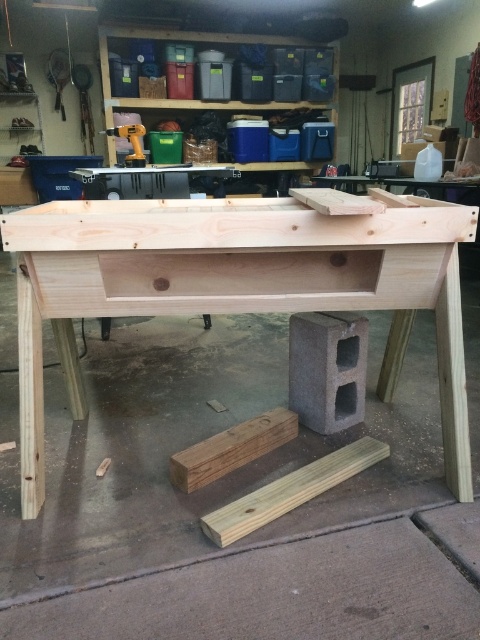
Question: Can you confirm if light brown wood plank at lower center is positioned below natural wood plank at center?

Choices:
 (A) yes
 (B) no

Answer: (A)

Question: Is natural wood table at center above natural wood plank at center?

Choices:
 (A) no
 (B) yes

Answer: (B)

Question: Among these points, which one is nearest to the camera?

Choices:
 (A) (299, 502)
 (B) (250, 454)
 (C) (446, 396)

Answer: (A)

Question: Which point is farther to the camera?

Choices:
 (A) (361, 305)
 (B) (121, 129)

Answer: (B)

Question: Which object is farther from the camera taking this photo?

Choices:
 (A) light brown wood plank at lower center
 (B) natural wood table at center
 (C) metallic yellow drill at upper center
 (D) natural wood plank at center

Answer: (C)

Question: Is light brown wood plank at lower center further to the viewer compared to natural wood plank at center?

Choices:
 (A) yes
 (B) no

Answer: (B)